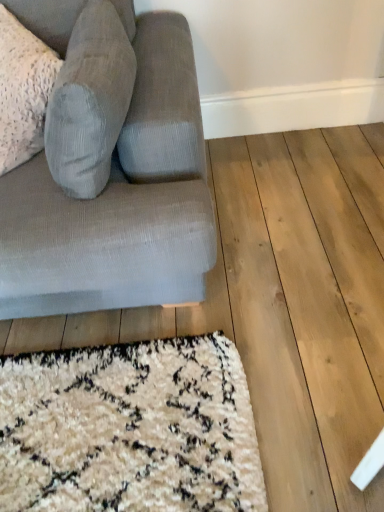
Question: Is textured gray couch at left bigger or smaller than textured corduroy pillow at left?

Choices:
 (A) small
 (B) big

Answer: (B)

Question: From the image's perspective, is textured gray couch at left above or below textured corduroy pillow at left?

Choices:
 (A) below
 (B) above

Answer: (A)

Question: Is point (94, 202) positioned closer to the camera than point (105, 17)?

Choices:
 (A) farther
 (B) closer

Answer: (B)

Question: In the image, is textured corduroy pillow at left positioned in front of or behind textured gray couch at left?

Choices:
 (A) front
 (B) behind

Answer: (B)

Question: Which is correct: textured corduroy pillow at left is inside textured gray couch at left, or outside of it?

Choices:
 (A) outside
 (B) inside

Answer: (B)

Question: In terms of size, does textured corduroy pillow at left appear bigger or smaller than textured gray couch at left?

Choices:
 (A) small
 (B) big

Answer: (A)

Question: From the image's perspective, is textured corduroy pillow at left positioned above or below textured gray couch at left?

Choices:
 (A) above
 (B) below

Answer: (A)